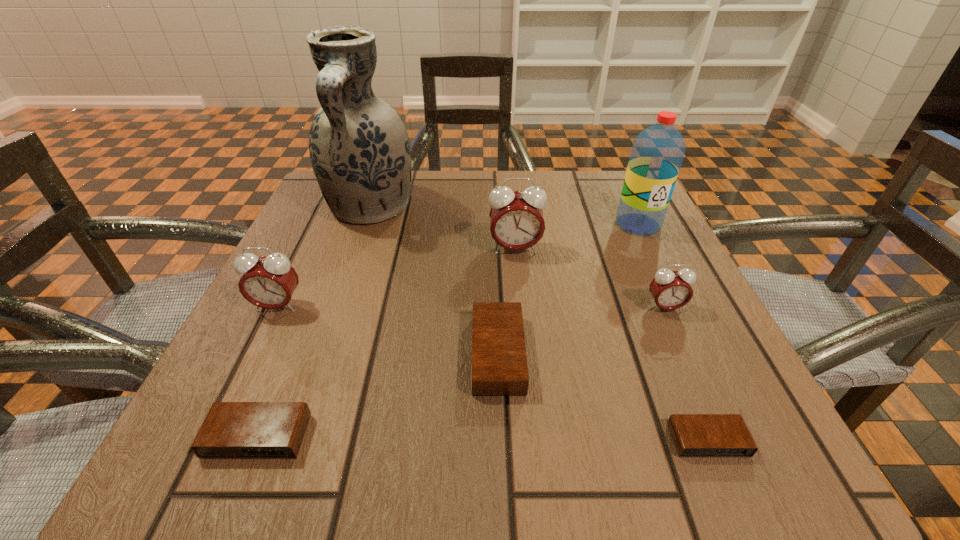
This screenshot has width=960, height=540. I want to click on free point located 0.250m on the clock face of the smallest pink alarm clock, so click(x=734, y=464).

You are a GUI agent. You are given a task and a screenshot of the screen. Output one action in this format:
    pyautogui.click(x=<x>, y=<y>)
    Task: Click on the vacant area located 0.320m on the front face of the biggest black alarm clock
    The height and width of the screenshot is (540, 960).
    Given the screenshot: What is the action you would take?
    pyautogui.click(x=257, y=354)

I want to click on vacant area situated 0.240m on the front face of the biggest black alarm clock, so click(311, 354).

This screenshot has height=540, width=960. I want to click on vacant space located on the front face of the biggest black alarm clock, so click(x=277, y=354).

At what (x,y) coordinates should I click in order to perform the action: click on vase present at the far edge. Please return your answer as a coordinate pair (x, y). This screenshot has height=540, width=960. Looking at the image, I should click on (359, 147).

The image size is (960, 540). Find the location of `water bottle located at the far edge`. water bottle located at the far edge is located at coordinates (657, 153).

This screenshot has height=540, width=960. What are the coordinates of `vase that is at the left edge` in the screenshot? It's located at (359, 147).

In order to click on water bottle that is at the right edge in this screenshot , I will do `click(657, 153)`.

Locate an element on the screen. This screenshot has height=540, width=960. object that is at the far left corner is located at coordinates (359, 147).

This screenshot has height=540, width=960. What are the coordinates of `object situated at the near left corner` in the screenshot? It's located at (231, 430).